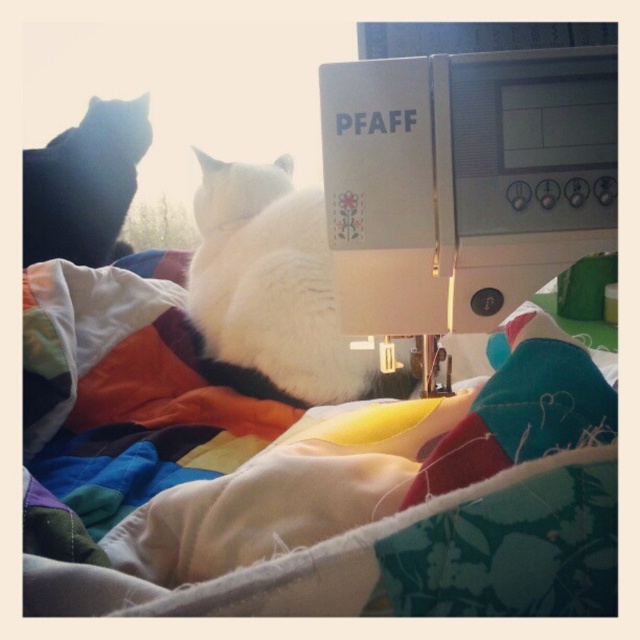
Question: Which object is farther from the camera taking this photo?

Choices:
 (A) white plastic sewing machine at upper right
 (B) multicolored quilt at center
 (C) black fur cat at left
 (D) white fluffy cat at center

Answer: (C)

Question: Which point is closer to the camera?

Choices:
 (A) multicolored quilt at center
 (B) white fluffy cat at center

Answer: (A)

Question: Which point appears farthest from the camera in this image?

Choices:
 (A) (74, 230)
 (B) (358, 68)

Answer: (A)

Question: Does white fluffy cat at center have a smaller size compared to black fur cat at left?

Choices:
 (A) no
 (B) yes

Answer: (A)

Question: Is multicolored quilt at center closer to the viewer compared to black fur cat at left?

Choices:
 (A) no
 (B) yes

Answer: (B)

Question: Does multicolored quilt at center have a larger size compared to white fluffy cat at center?

Choices:
 (A) yes
 (B) no

Answer: (A)